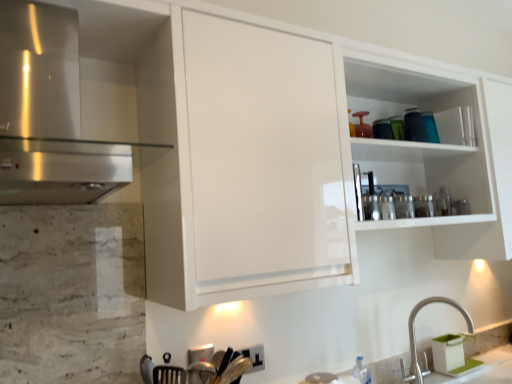
Question: Looking at the image, does stainless steel range hood at left seem bigger or smaller compared to satin nickel faucet at lower right?

Choices:
 (A) small
 (B) big

Answer: (B)

Question: Does point (18, 178) appear closer or farther from the camera than point (411, 311)?

Choices:
 (A) farther
 (B) closer

Answer: (B)

Question: Based on their positions, is stainless steel range hood at left located to the left or right of satin nickel faucet at lower right?

Choices:
 (A) left
 (B) right

Answer: (A)

Question: Relative to stainless steel range hood at left, is satin nickel faucet at lower right in front or behind?

Choices:
 (A) behind
 (B) front

Answer: (A)

Question: Is satin nickel faucet at lower right situated inside stainless steel range hood at left or outside?

Choices:
 (A) inside
 (B) outside

Answer: (B)

Question: From a real-world perspective, is satin nickel faucet at lower right positioned above or below stainless steel range hood at left?

Choices:
 (A) below
 (B) above

Answer: (A)

Question: Based on their sizes in the image, would you say satin nickel faucet at lower right is bigger or smaller than stainless steel range hood at left?

Choices:
 (A) small
 (B) big

Answer: (A)